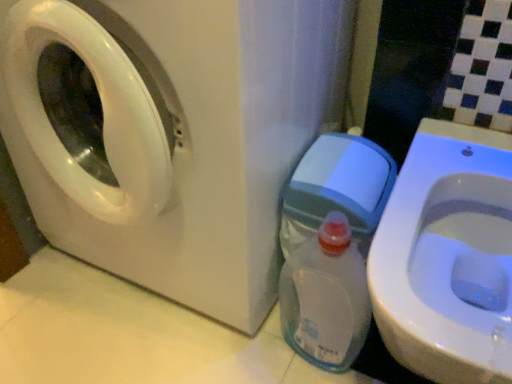
Question: From a real-world perspective, is white glossy toilet at lower right physically below clear plastic bottle at lower right?

Choices:
 (A) no
 (B) yes

Answer: (A)

Question: Considering the relative positions of white glossy toilet at lower right and clear plastic bottle at lower right in the image provided, is white glossy toilet at lower right to the left of clear plastic bottle at lower right from the viewer's perspective?

Choices:
 (A) no
 (B) yes

Answer: (A)

Question: Would you say white glossy toilet at lower right is outside clear plastic bottle at lower right?

Choices:
 (A) yes
 (B) no

Answer: (A)

Question: Can you confirm if white glossy toilet at lower right is taller than clear plastic bottle at lower right?

Choices:
 (A) no
 (B) yes

Answer: (B)

Question: Does white glossy toilet at lower right lie in front of clear plastic bottle at lower right?

Choices:
 (A) yes
 (B) no

Answer: (A)

Question: Considering their positions, is clear plastic bottle at lower right located in front of or behind white glossy toilet at lower right?

Choices:
 (A) front
 (B) behind

Answer: (B)

Question: In terms of width, does clear plastic bottle at lower right look wider or thinner when compared to white glossy toilet at lower right?

Choices:
 (A) thin
 (B) wide

Answer: (A)

Question: Is clear plastic bottle at lower right taller or shorter than white glossy toilet at lower right?

Choices:
 (A) tall
 (B) short

Answer: (B)

Question: In the image, is clear plastic bottle at lower right on the left side or the right side of white glossy toilet at lower right?

Choices:
 (A) right
 (B) left

Answer: (B)

Question: Based on their sizes in the image, would you say white glossy toilet at lower right is bigger or smaller than clear plastic bottle at lower right?

Choices:
 (A) small
 (B) big

Answer: (B)

Question: Is white glossy toilet at lower right in front of or behind clear plastic bottle at lower right in the image?

Choices:
 (A) front
 (B) behind

Answer: (A)

Question: Based on their positions, is white glossy toilet at lower right located to the left or right of clear plastic bottle at lower right?

Choices:
 (A) left
 (B) right

Answer: (B)

Question: Is point (508, 301) closer or farther from the camera than point (305, 259)?

Choices:
 (A) closer
 (B) farther

Answer: (A)

Question: Considering the positions of point (240, 165) and point (502, 173), is point (240, 165) closer or farther from the camera than point (502, 173)?

Choices:
 (A) farther
 (B) closer

Answer: (B)

Question: Would you say white glossy washing machine at left is to the left or to the right of white glossy toilet at lower right in the picture?

Choices:
 (A) left
 (B) right

Answer: (A)